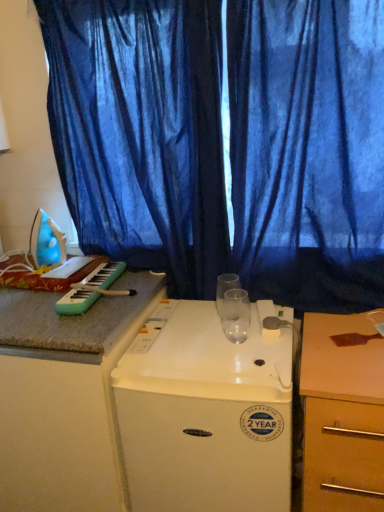
Question: Considering the relative sizes of wooden at right and blue plastic iron at left in the image provided, is wooden at right shorter than blue plastic iron at left?

Choices:
 (A) no
 (B) yes

Answer: (A)

Question: Does wooden at right turn towards blue plastic iron at left?

Choices:
 (A) no
 (B) yes

Answer: (A)

Question: Can you confirm if wooden at right is thinner than blue plastic iron at left?

Choices:
 (A) yes
 (B) no

Answer: (B)

Question: Can you confirm if wooden at right is wider than blue plastic iron at left?

Choices:
 (A) yes
 (B) no

Answer: (A)

Question: Is wooden at right to the right of blue plastic iron at left from the viewer's perspective?

Choices:
 (A) no
 (B) yes

Answer: (B)

Question: Considering their positions, is white plastic refrigerator at center located in front of or behind green plastic keyboard at left?

Choices:
 (A) front
 (B) behind

Answer: (A)

Question: Is point (264, 467) positioned closer to the camera than point (96, 278)?

Choices:
 (A) closer
 (B) farther

Answer: (A)

Question: Based on their positions, is white plastic refrigerator at center located to the left or right of green plastic keyboard at left?

Choices:
 (A) left
 (B) right

Answer: (B)

Question: From the image's perspective, is white plastic refrigerator at center above or below green plastic keyboard at left?

Choices:
 (A) above
 (B) below

Answer: (B)

Question: Considering the positions of wooden at right and blue fabric curtain at center, marked as the second curtain in a left-to-right arrangement, in the image, is wooden at right taller or shorter than blue fabric curtain at center, marked as the second curtain in a left-to-right arrangement,?

Choices:
 (A) short
 (B) tall

Answer: (A)

Question: Is wooden at right in front of or behind blue fabric curtain at center, marked as the 1th curtain in a right-to-left arrangement, in the image?

Choices:
 (A) front
 (B) behind

Answer: (A)

Question: From the image's perspective, is wooden at right positioned above or below blue fabric curtain at center, marked as the 1th curtain in a right-to-left arrangement?

Choices:
 (A) above
 (B) below

Answer: (B)

Question: From a real-world perspective, is wooden at right above or below blue fabric curtain at center, marked as the second curtain in a left-to-right arrangement?

Choices:
 (A) below
 (B) above

Answer: (A)

Question: Visually, is blue sheer curtain at upper center, which ranks as the first curtain in left-to-right order, positioned to the left or to the right of blue fabric curtain at center, marked as the 1th curtain in a right-to-left arrangement?

Choices:
 (A) left
 (B) right

Answer: (A)

Question: From the image's perspective, is blue sheer curtain at upper center, the second curtain positioned from the right, positioned above or below blue fabric curtain at center, marked as the second curtain in a left-to-right arrangement?

Choices:
 (A) below
 (B) above

Answer: (B)